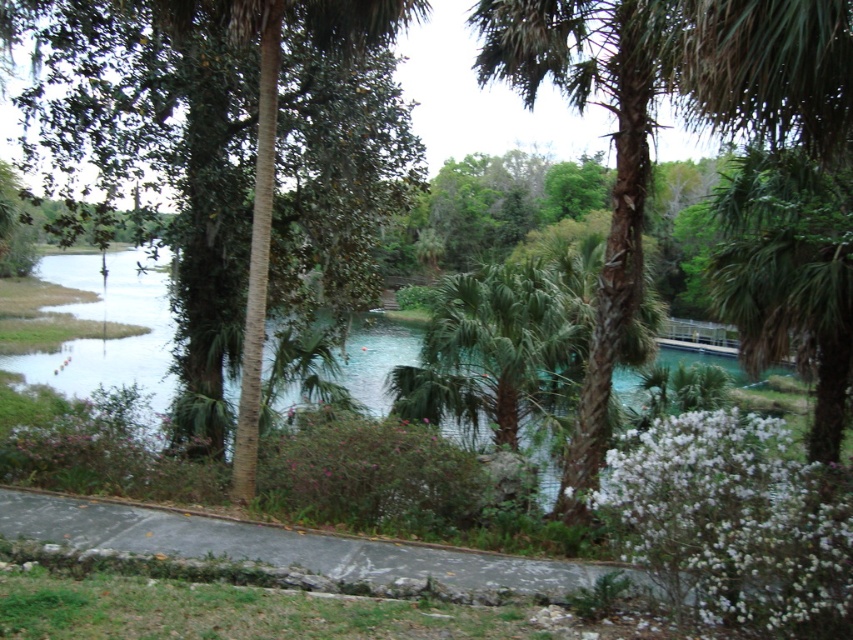
Question: Is brown textured palm tree at center positioned before green leafy palm tree at center?

Choices:
 (A) no
 (B) yes

Answer: (B)

Question: Does brown textured palm tree at center have a smaller size compared to green leafy palm tree at left?

Choices:
 (A) no
 (B) yes

Answer: (A)

Question: Among these objects, which one is farthest from the camera?

Choices:
 (A) green leafy palm tree at center
 (B) brown textured palm tree at center

Answer: (A)

Question: Which point is closer to the camera?

Choices:
 (A) coord(682,35)
 (B) coord(444,340)

Answer: (A)

Question: Which of these objects is positioned closest to the brown textured palm tree at center?

Choices:
 (A) green leafy palm tree at center
 (B) green leafy palm tree at left

Answer: (A)

Question: Can you confirm if brown textured palm tree at center is positioned above green leafy palm tree at center?

Choices:
 (A) no
 (B) yes

Answer: (B)